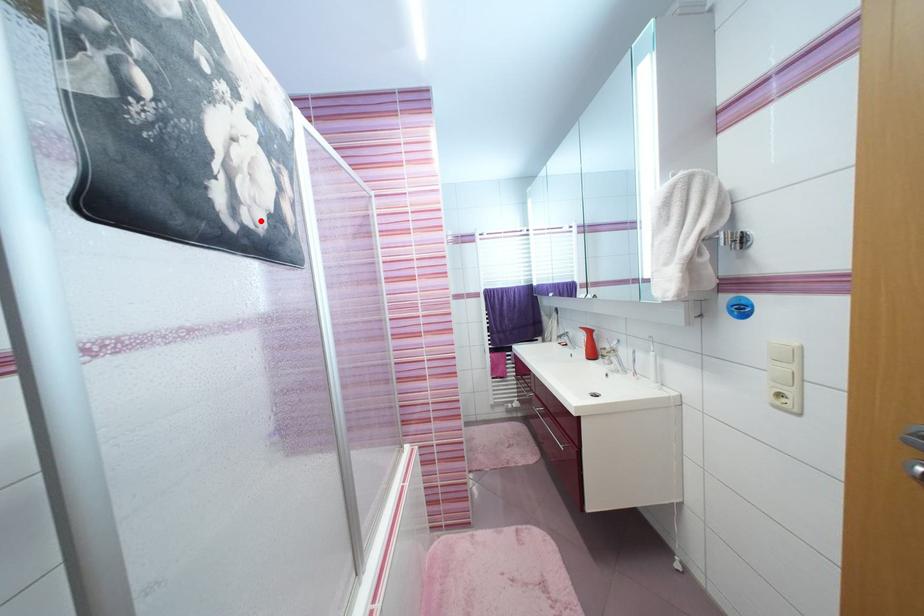
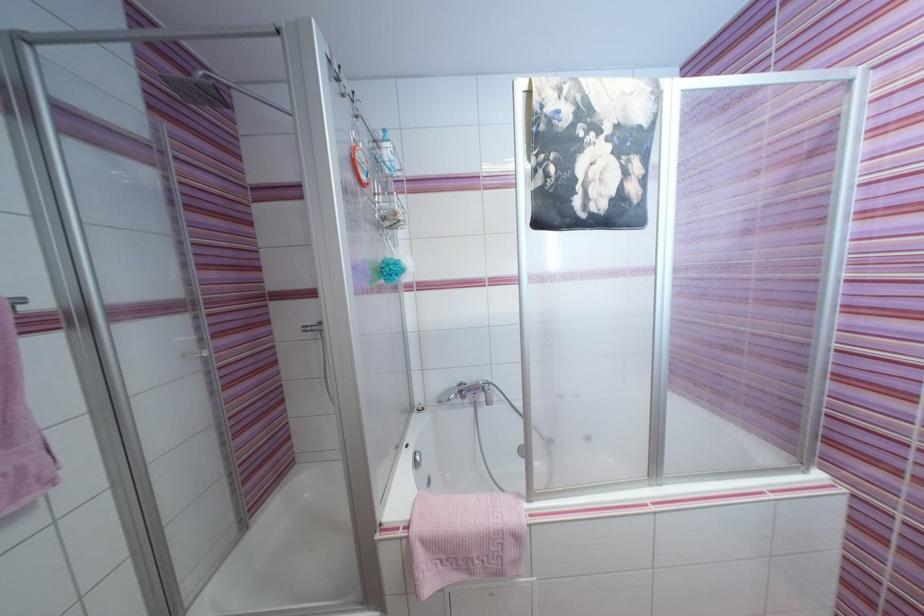
The point at the highlighted location is marked in the first image. Where is the corresponding point in the second image?

(604, 208)